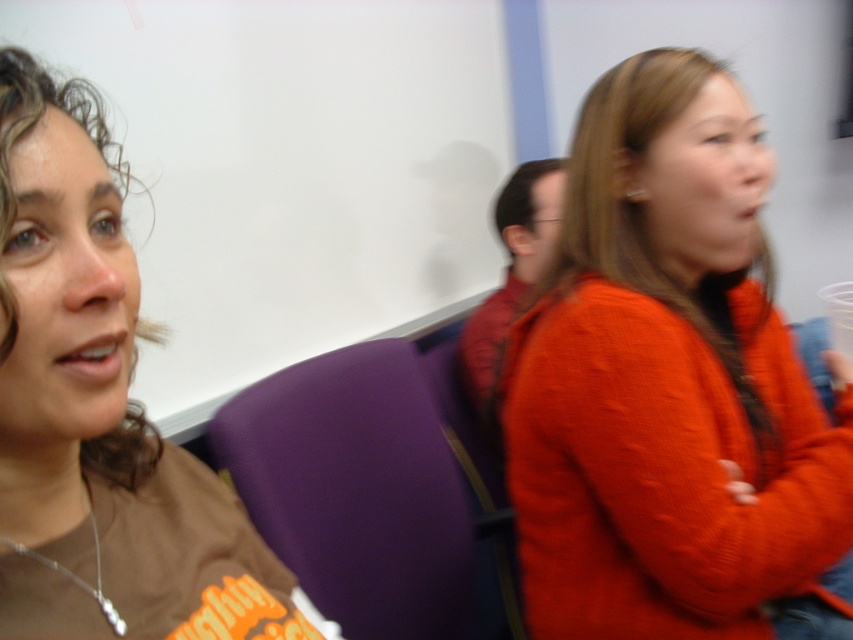
Does orange knitted sweater at right appear over brown cotton shirt at left?

Correct, orange knitted sweater at right is located above brown cotton shirt at left.

Who is more forward, (706, 372) or (32, 497)?

Point (32, 497) is in front.

You are a GUI agent. You are given a task and a screenshot of the screen. Output one action in this format:
    pyautogui.click(x=<x>, y=<y>)
    Task: Click on the orange knitted sweater at right
    This screenshot has width=853, height=640.
    Given the screenshot: What is the action you would take?
    pyautogui.click(x=668, y=385)

Is point (148, 600) farther from camera compared to point (318, 410)?

No, it is in front of (318, 410).

Measure the distance between brown cotton shirt at left and camera.

brown cotton shirt at left is 13.52 inches from camera.

At what (x,y) coordinates should I click in order to perform the action: click on brown cotton shirt at left. Please return your answer as a coordinate pair (x, y). Looking at the image, I should click on (100, 413).

Locate an element on the screen. The width and height of the screenshot is (853, 640). brown cotton shirt at left is located at coordinates (100, 413).

Who is lower down, orange knitted sweater at right or purple fabric chair at center?

purple fabric chair at center is lower down.

Does orange knitted sweater at right lie behind purple fabric chair at center?

No, it is not.

Does point (656, 392) lie in front of point (248, 458)?

Yes, it is in front of point (248, 458).

This screenshot has width=853, height=640. I want to click on orange knitted sweater at right, so click(668, 385).